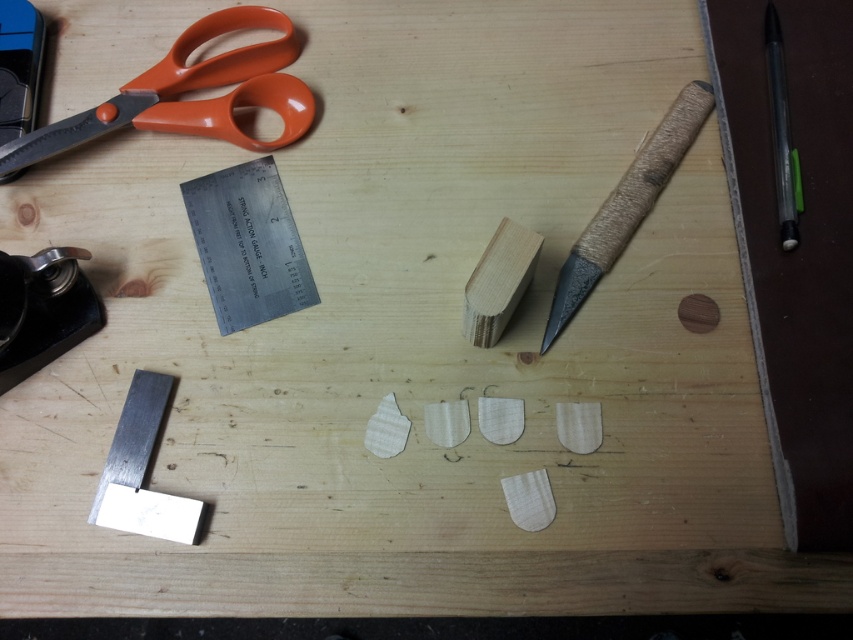
Which is more to the left, wooden textured pencil at upper right or black plastic pen at upper right?

From the viewer's perspective, wooden textured pencil at upper right appears more on the left side.

Is wooden textured pencil at upper right smaller than black plastic pen at upper right?

Incorrect, wooden textured pencil at upper right is not smaller in size than black plastic pen at upper right.

Does point (613, 224) come farther from viewer compared to point (786, 140)?

Yes, point (613, 224) is farther from viewer.

This screenshot has width=853, height=640. I want to click on wooden textured pencil at upper right, so click(625, 204).

Which is below, orange plastic scissors at upper left or wooden textured pencil at upper right?

wooden textured pencil at upper right is lower down.

Which is more to the left, orange plastic scissors at upper left or wooden textured pencil at upper right?

orange plastic scissors at upper left is more to the left.

Identify the location of orange plastic scissors at upper left. (189, 90).

Consider the image. Can you confirm if wooden textured pencil at upper right is bigger than metallic black stapler at lower left?

Yes, wooden textured pencil at upper right is bigger than metallic black stapler at lower left.

Can you confirm if wooden textured pencil at upper right is shorter than metallic black stapler at lower left?

In fact, wooden textured pencil at upper right may be taller than metallic black stapler at lower left.

Locate an element on the screen. The width and height of the screenshot is (853, 640). wooden textured pencil at upper right is located at coordinates (625, 204).

Identify the location of wooden textured pencil at upper right. The height and width of the screenshot is (640, 853). (625, 204).